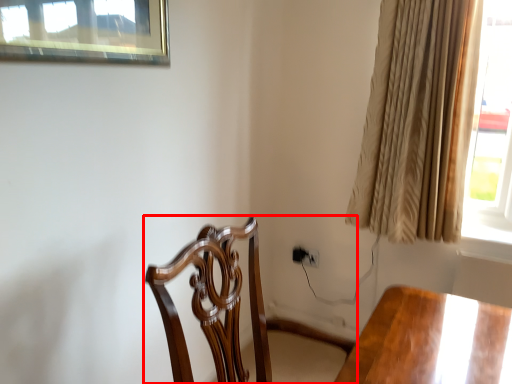
Question: From the image's perspective, what is the correct spatial relationship of chair (annotated by the red box) in relation to curtain?

Choices:
 (A) below
 (B) above

Answer: (A)